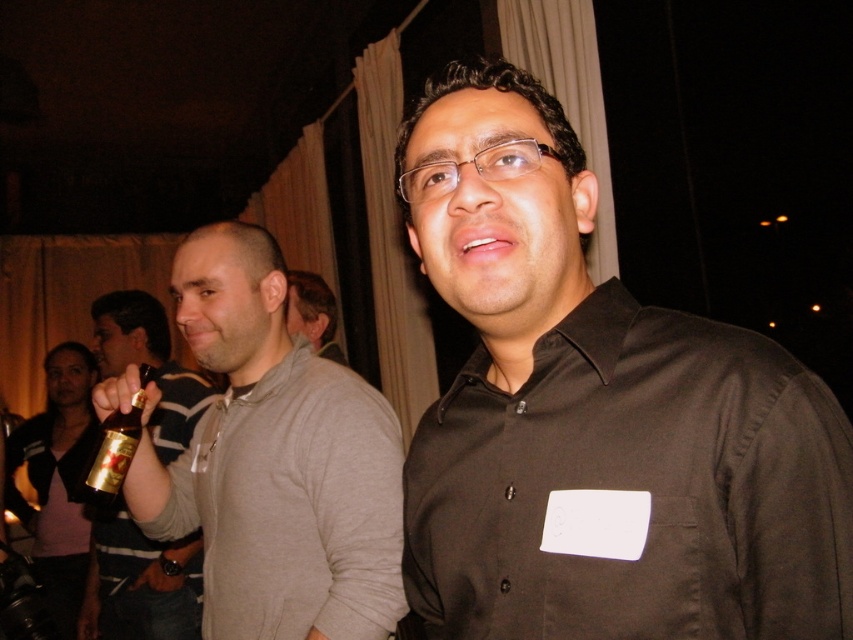
You are at a party and want to grab the gold metallic bottle at left without touching the gray cotton sweater at left. Is it possible?

The gray cotton sweater at left is in front of the gold metallic bottle at left, so you would have to move the sweater to access the bottle.

You are at a party and want to grab the gold metallic bottle at center. However, there is a light brown sweater at center in the way. Which object is closer to you so you can reach it first?

The gold metallic bottle at center is positioned on the left side of light brown sweater at center, so you can reach it first before the light brown sweater at center.

You are a photographer at the event and want to capture a closeup of the gray cotton sweater at left without moving the camera. Can you confirm if the sweater is within the camera focus range of 36 inches?

The gray cotton sweater at left is 38.48 inches away from camera, which is slightly beyond the camera focus range of 36 inches. The photographer would need to move closer or adjust the focus settings to capture it clearly.